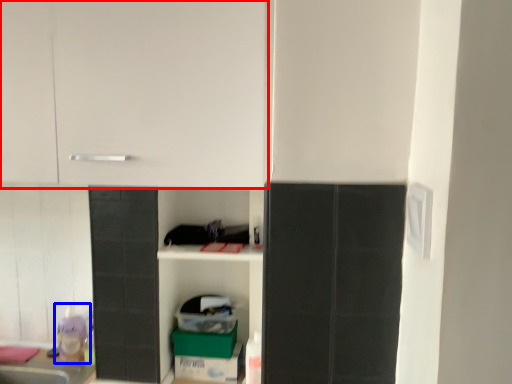
Question: Which object is further to the camera taking this photo, cabinetry (highlighted by a red box) or toy (highlighted by a blue box)?

Choices:
 (A) cabinetry
 (B) toy

Answer: (B)